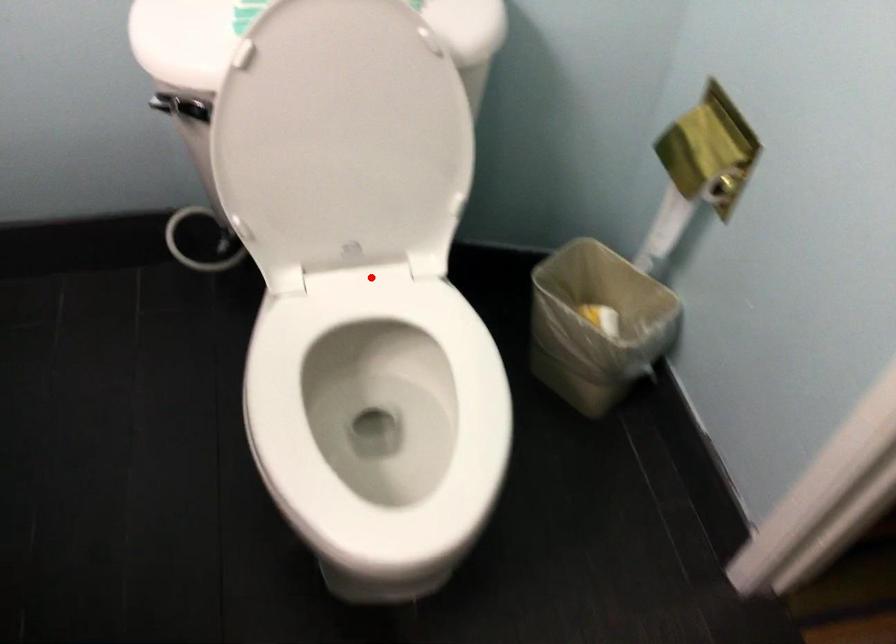
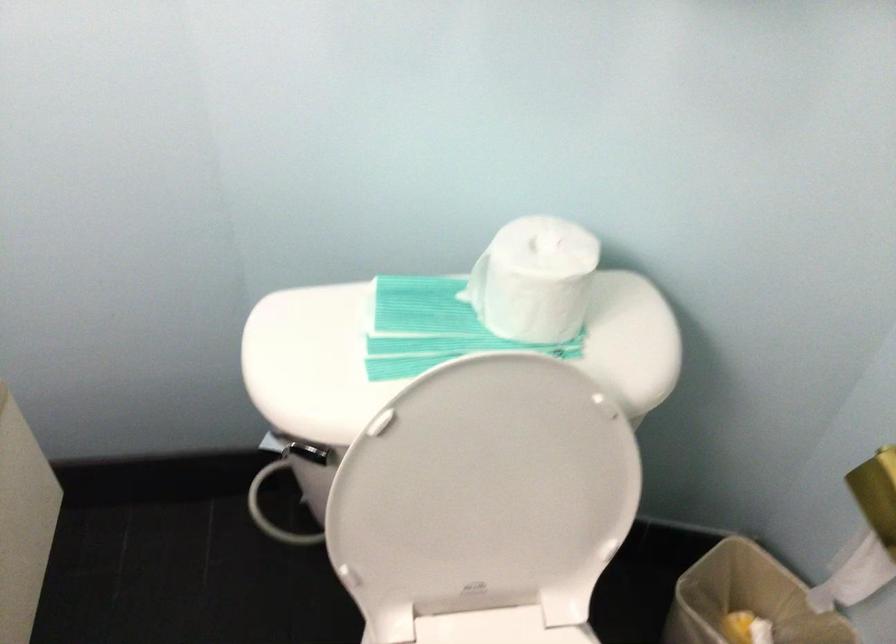
Find the pixel in the second image that matches the highlighted location in the first image.

(497, 627)